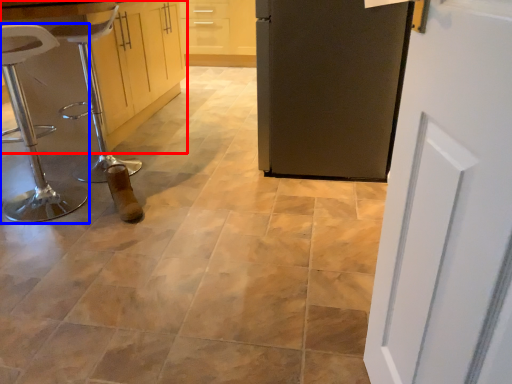
Question: Which object is closer to the camera taking this photo, cabinetry (highlighted by a red box) or furniture (highlighted by a blue box)?

Choices:
 (A) cabinetry
 (B) furniture

Answer: (B)